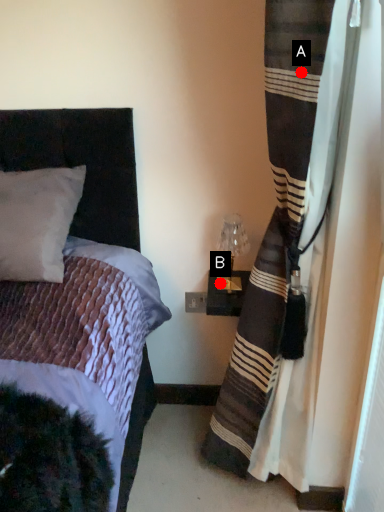
Question: Two points are circled on the image, labeled by A and B beside each circle. Which point is further to the camera?

Choices:
 (A) A is further
 (B) B is further

Answer: (B)